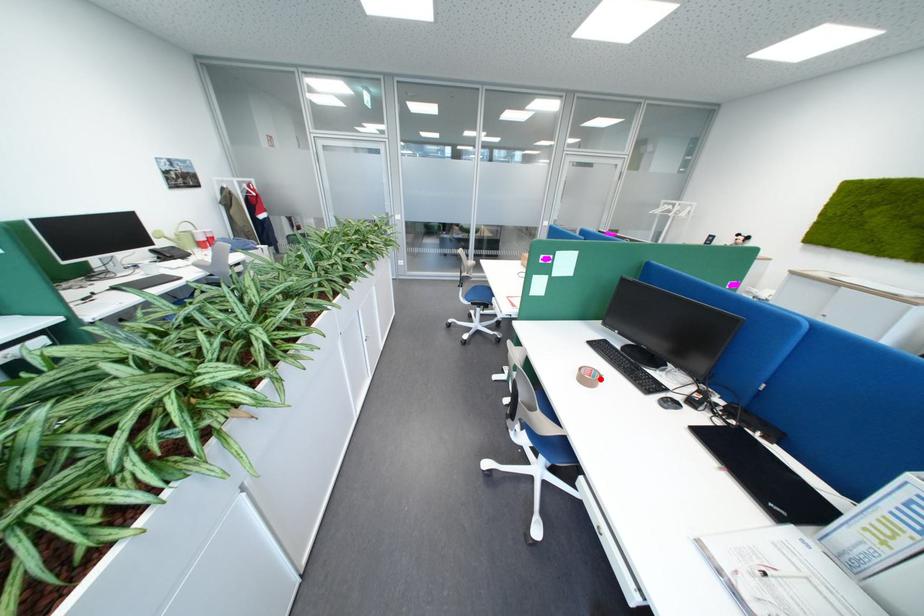
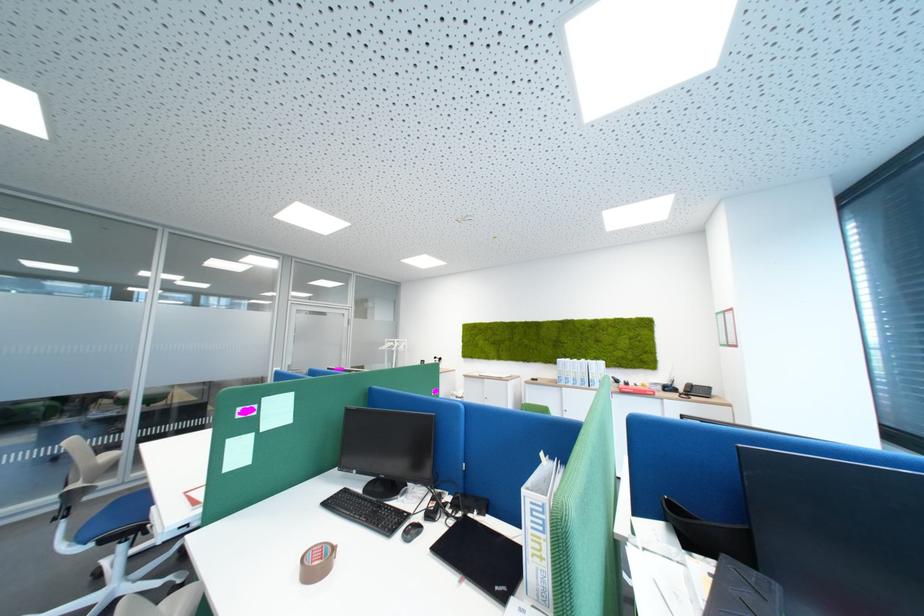
The point at the highlighted location is marked in the first image. Where is the corresponding point in the second image?

(330, 565)